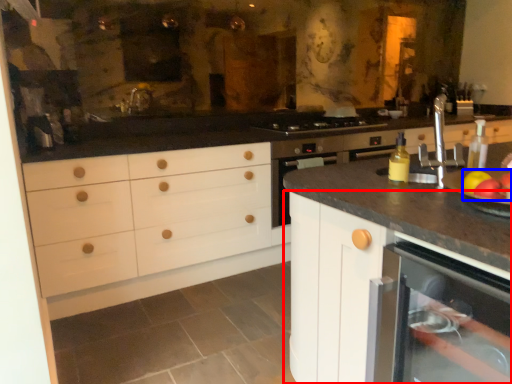
Question: Which of the following is the farthest to the observer, cabinetry (highlighted by a red box) or apple (highlighted by a blue box)?

Choices:
 (A) cabinetry
 (B) apple

Answer: (B)